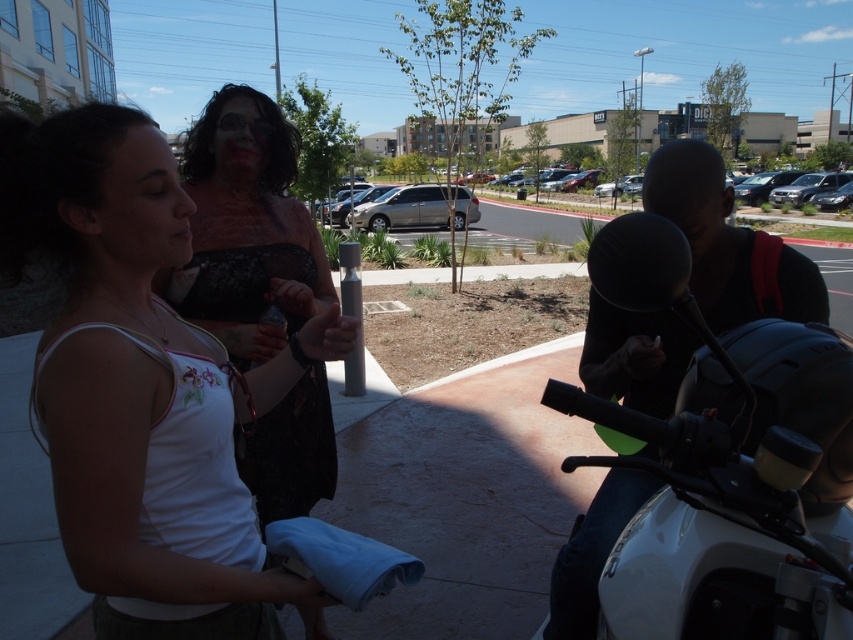
Question: In this image, where is white fabric tank top at center located relative to white glossy motorcycle at right?

Choices:
 (A) below
 (B) above

Answer: (B)

Question: Is white fabric tank top at center further to the viewer compared to white glossy motorcycle at right?

Choices:
 (A) yes
 (B) no

Answer: (B)

Question: Which of the following is the farthest from the observer?

Choices:
 (A) (78, 525)
 (B) (680, 502)

Answer: (B)

Question: Among these points, which one is farthest from the camera?

Choices:
 (A) (653, 628)
 (B) (15, 240)

Answer: (A)

Question: Can you confirm if white fabric tank top at center is positioned to the left of white glossy motorcycle at right?

Choices:
 (A) yes
 (B) no

Answer: (A)